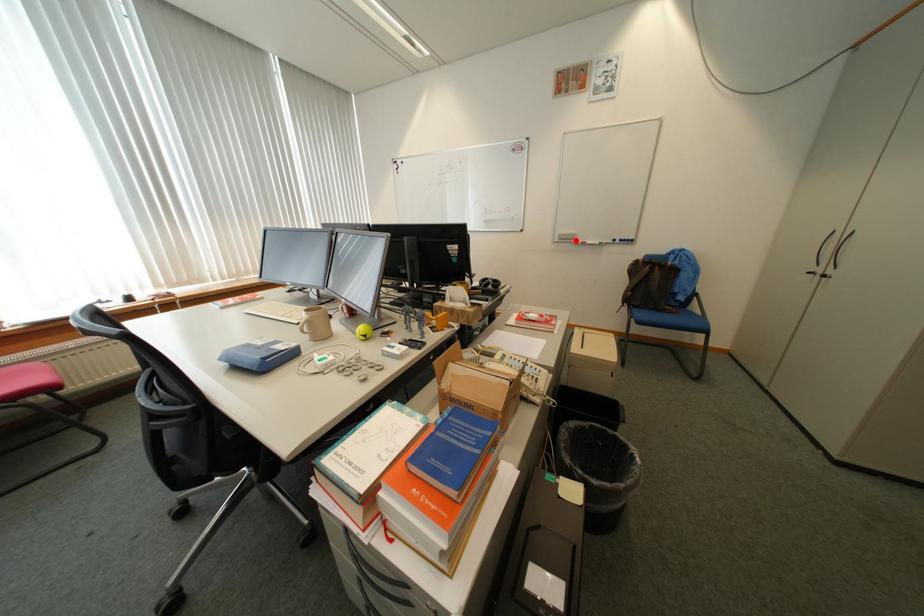
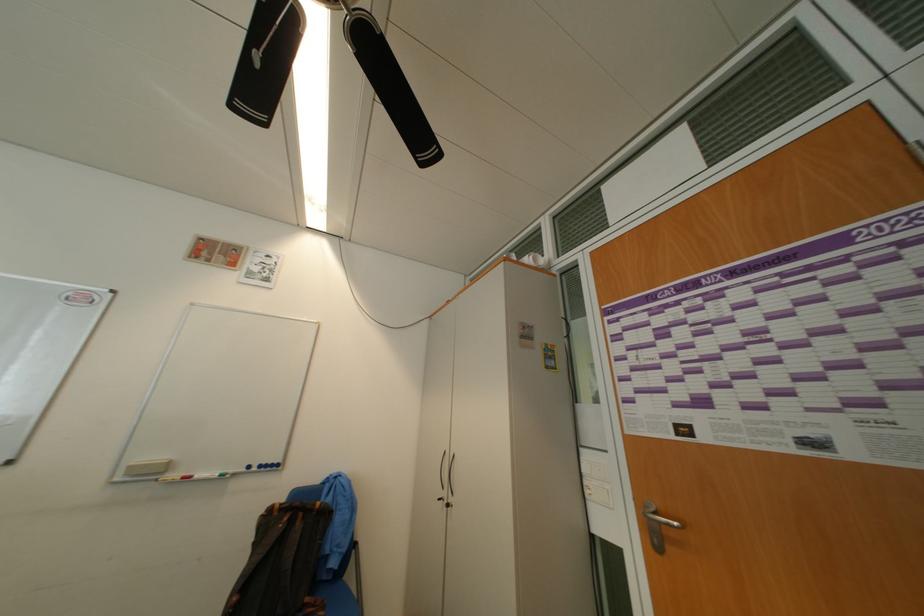
Where in the second image is the point corresponding to the highlighted location from the first image?

(159, 475)